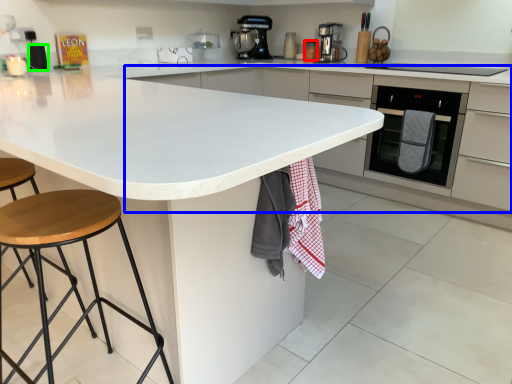
Question: Estimate the real-world distances between objects in this image. Which object is closer to appliance (highlighted by a red box), cabinetry (highlighted by a blue box) or appliance (highlighted by a green box)?

Choices:
 (A) cabinetry
 (B) appliance

Answer: (A)